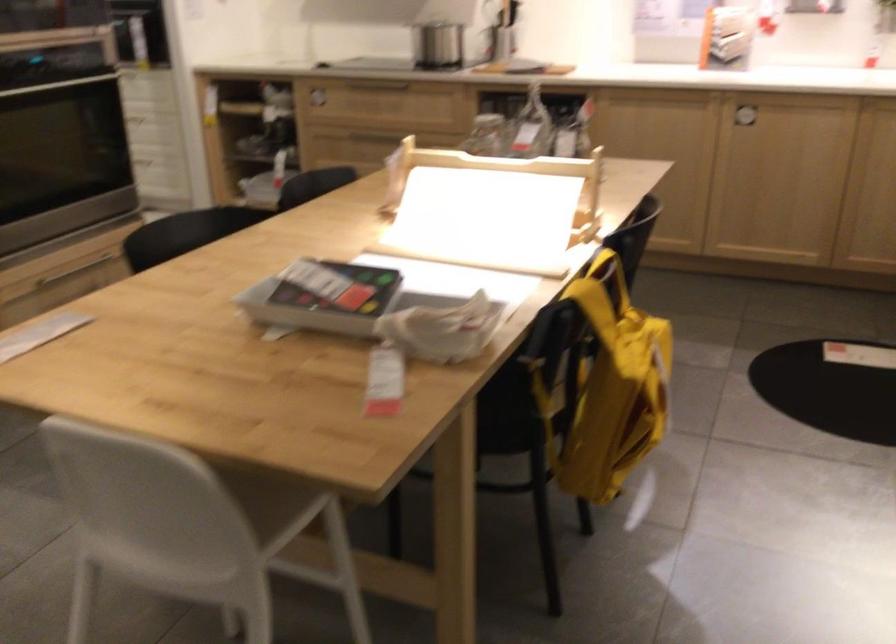
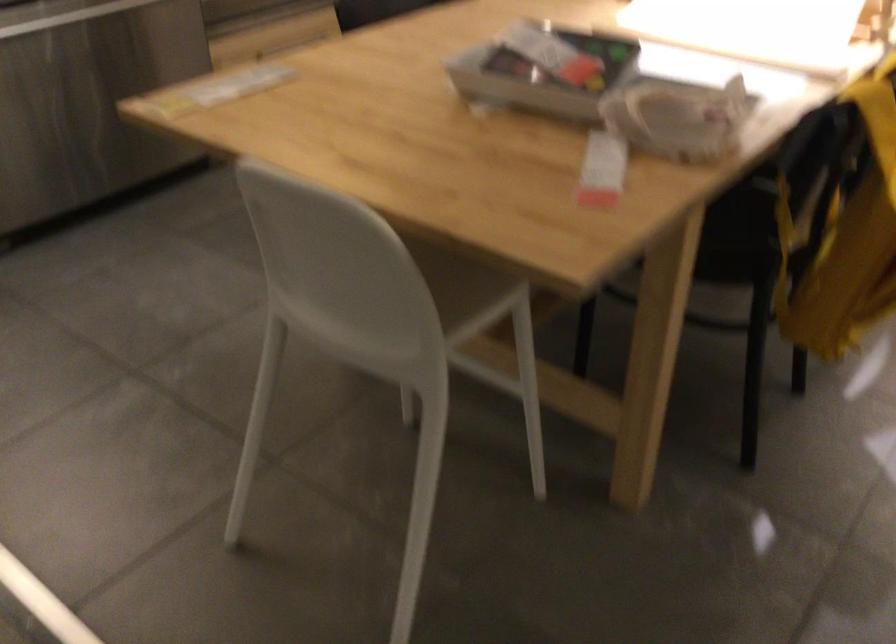
Where in the second image is the point corresponding to the point at 441,328 from the first image?

(677, 117)